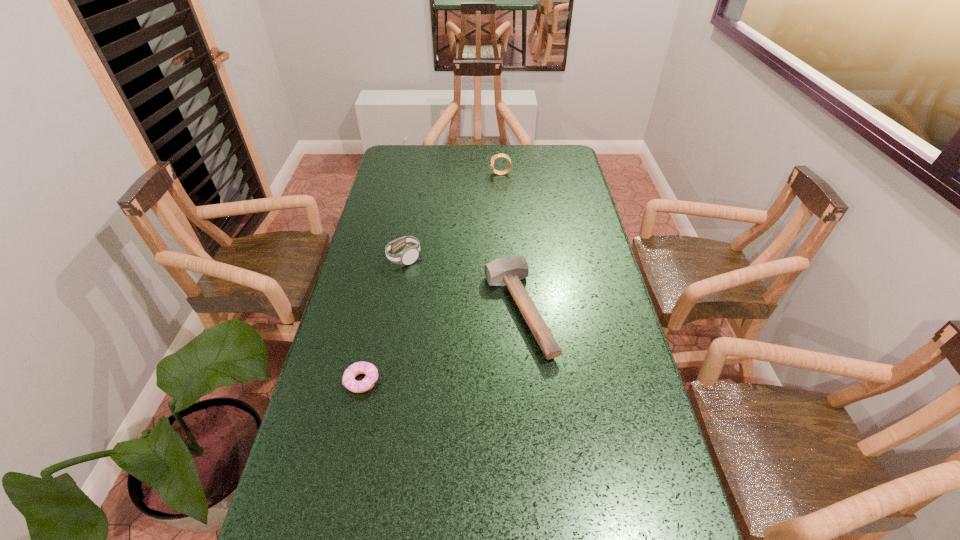
Locate an element on the screen. free space that satisfies the following two spatial constraints: 1. on the face of the third tallest object; 2. on the left side of the farther watch is located at coordinates (510, 310).

This screenshot has height=540, width=960. In order to click on free space that satisfies the following two spatial constraints: 1. on the face of the second shortest object; 2. on the right side of the nearer watch in this screenshot , I will do `click(395, 310)`.

You are a GUI agent. You are given a task and a screenshot of the screen. Output one action in this format:
    pyautogui.click(x=<x>, y=<y>)
    Task: Click on the free location that satisfies the following two spatial constraints: 1. on the back side of the mallet; 2. on the face of the farther watch
    
    Given the screenshot: What is the action you would take?
    pyautogui.click(x=507, y=174)

The width and height of the screenshot is (960, 540). In order to click on vacant space that satisfies the following two spatial constraints: 1. on the face of the right watch; 2. on the front side of the nearest object in this screenshot , I will do `click(514, 381)`.

Where is `vacant region that satisfies the following two spatial constraints: 1. on the face of the mallet; 2. on the left side of the right watch`? vacant region that satisfies the following two spatial constraints: 1. on the face of the mallet; 2. on the left side of the right watch is located at coordinates (510, 310).